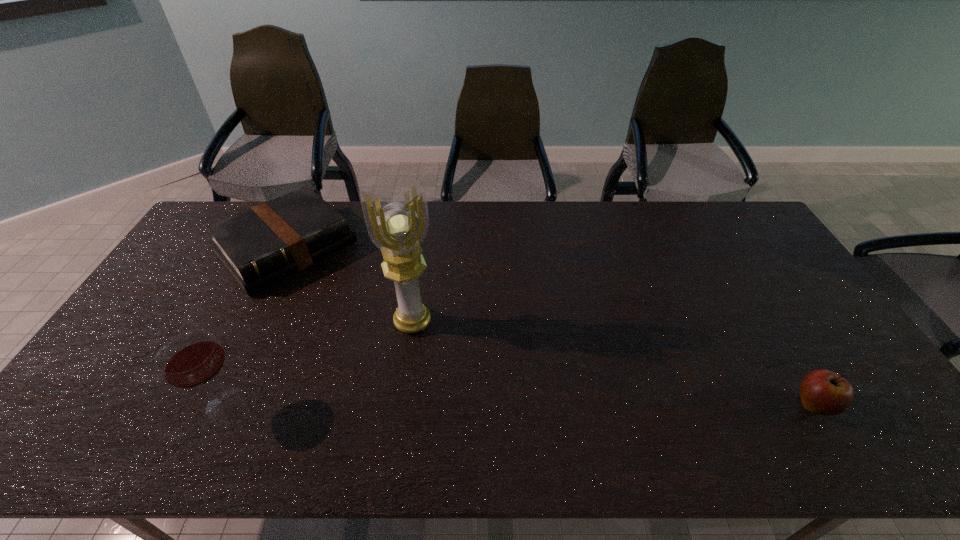
The image size is (960, 540). I want to click on vacant region between the third tallest object and the third object from left to right, so click(x=612, y=363).

Locate an element on the screen. unoccupied position between the apple and the award is located at coordinates pos(612,363).

The height and width of the screenshot is (540, 960). What are the coordinates of `vacant space that is in between the wineglass and the farthest object` in the screenshot? It's located at (255, 326).

Locate an element on the screen. unoccupied area between the third shortest object and the second shortest object is located at coordinates (519, 405).

Identify the location of vacant area that lies between the second farthest object and the wineglass. (319, 363).

Identify the location of free spot between the tallest object and the apple. This screenshot has width=960, height=540. (612, 363).

In order to click on vacant area that lies between the hardback book and the tallest object in this screenshot , I will do `click(349, 285)`.

Select which object appears as the closest to the wineglass. Please provide its 2D coordinates. Your answer should be formatted as a tuple, i.e. [(x, y)], where the tuple contains the x and y coordinates of a point satisfying the conditions above.

[(260, 246)]

Locate an element on the screen. the closest object to the second tallest object is located at coordinates (260, 246).

The height and width of the screenshot is (540, 960). I want to click on vacant point that satisfies the following two spatial constraints: 1. on the front side of the second tallest object; 2. on the left side of the shortest object, so click(x=209, y=404).